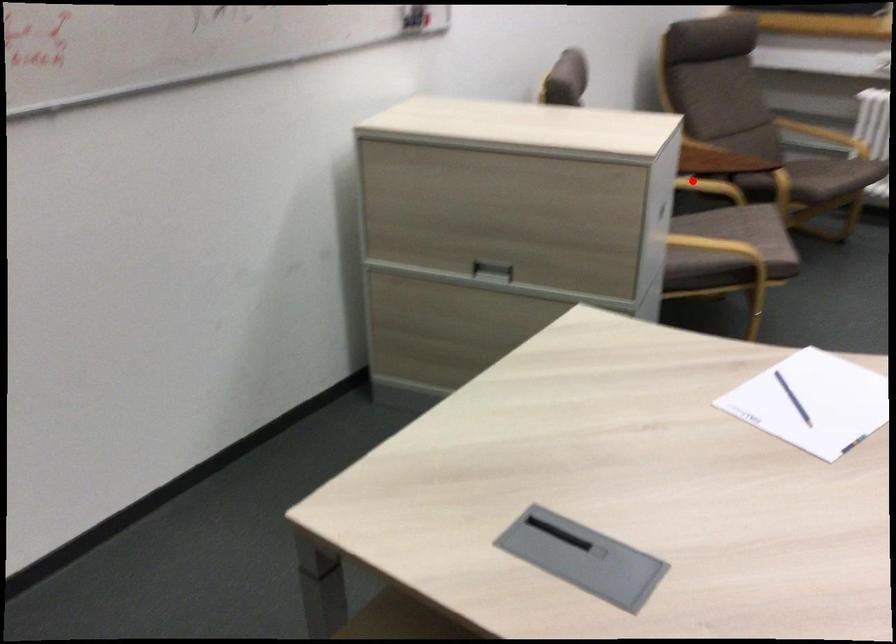
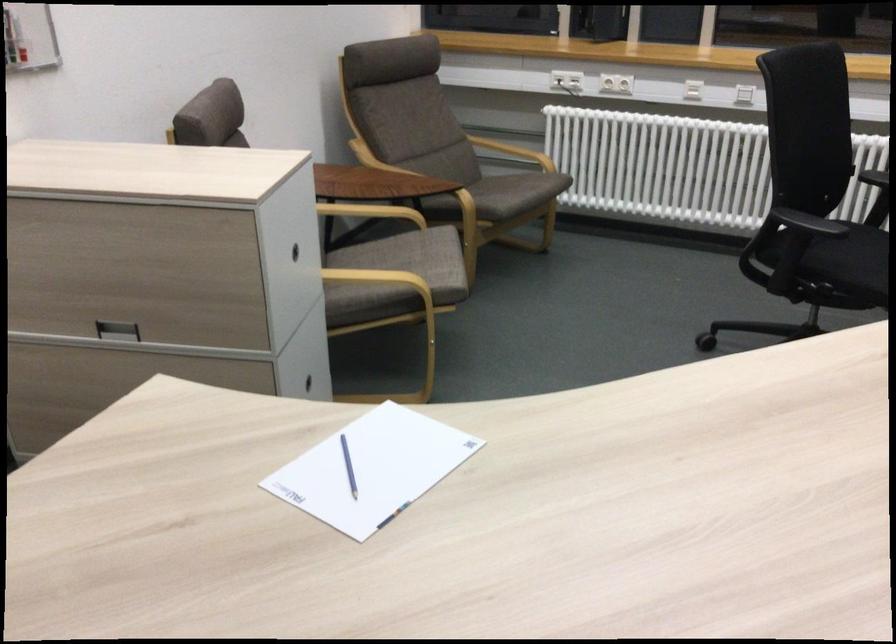
The point at the highlighted location is marked in the first image. Where is the corresponding point in the second image?

(371, 212)